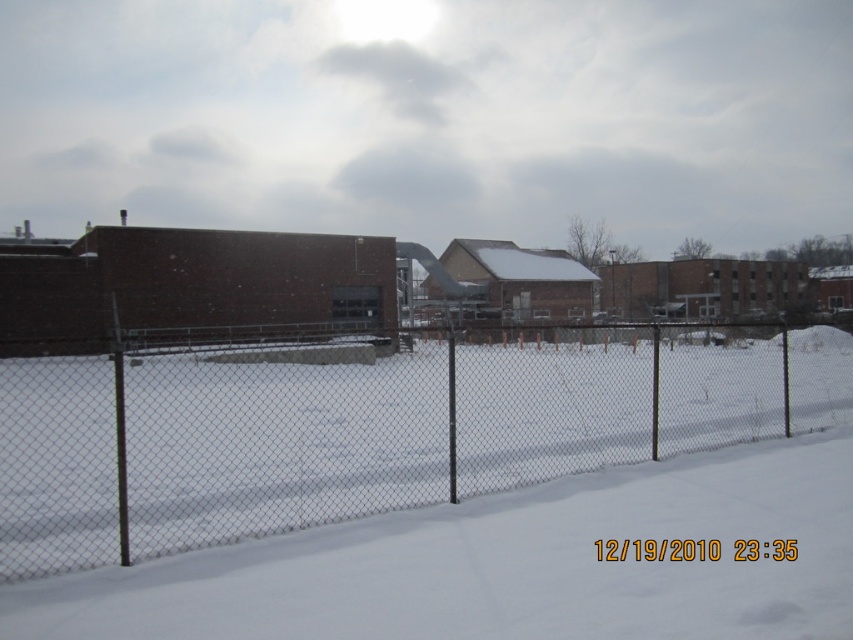
You are standing in the snowy scene and want to walk towards the buildings in the background. Which object, the wire mesh fence at center or the white powdery snow at center, must you pass through first?

You must pass through the wire mesh fence at center first because it is closer to you than the white powdery snow at center, which is further away.

You are standing at the point with coordinates point [90,636] and want to walk towards the point with coordinates point [364,451]. Will the fence block your path?

Point [364,451] is behind point [90,636], so the fence will block your path to point [364,451].